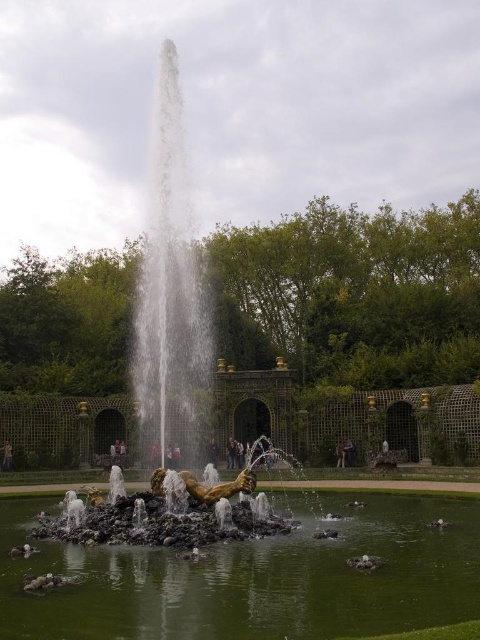
You are standing in the garden and want to take a closer look at the gold metallic statue at center. If you walk directly towards it, how far will you have to walk?

The gold metallic statue at center is 130.27 feet away from the camera, so you will have to walk 130.27 feet to reach it.

You are standing at the center of the garden and want to locate the gold metallic statue at center. According to the coordinates provided, where exactly should you look?

The gold metallic statue at center is located at coordinates point (x=169, y=372).